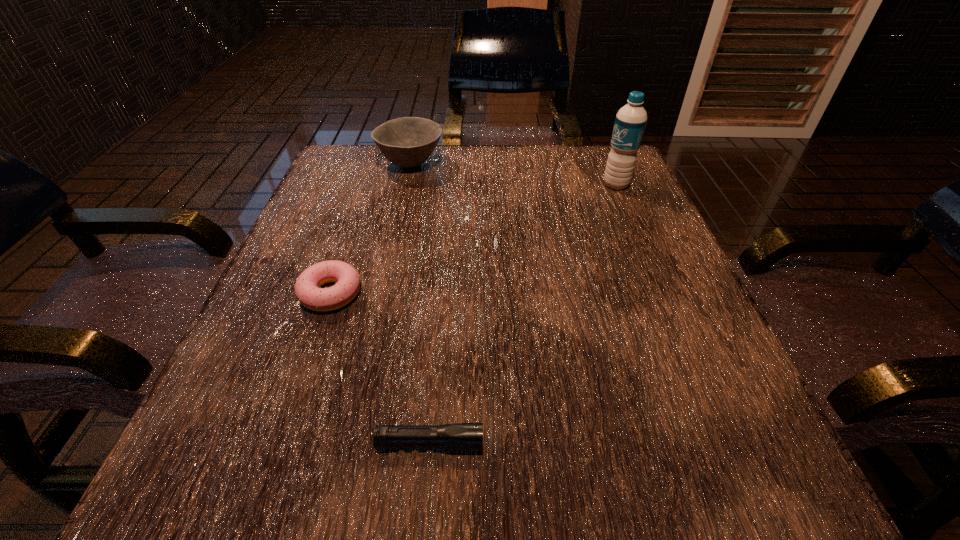
You are a GUI agent. You are given a task and a screenshot of the screen. Output one action in this format:
    pyautogui.click(x=<x>, y=<y>)
    Task: Click on the water bottle
    Image resolution: width=960 pixels, height=540 pixels.
    Given the screenshot: What is the action you would take?
    pyautogui.click(x=630, y=122)

Locate an element on the screen. the rightmost object is located at coordinates (630, 122).

I want to click on the second tallest object, so click(x=407, y=142).

At what (x,y) coordinates should I click in order to perform the action: click on the third tallest object. Please return your answer as a coordinate pair (x, y). Image resolution: width=960 pixels, height=540 pixels. Looking at the image, I should click on (307, 291).

This screenshot has width=960, height=540. I want to click on doughnut, so click(307, 291).

What are the coordinates of `the shortest object` in the screenshot? It's located at (460, 436).

Locate an element on the screen. flashlight is located at coordinates (460, 436).

The height and width of the screenshot is (540, 960). I want to click on free space located on the label of the water bottle, so click(567, 185).

I want to click on vacant space situated on the label of the water bottle, so click(549, 185).

In order to click on vacant area located 0.180m on the label of the water bottle in this screenshot , I will do `click(523, 185)`.